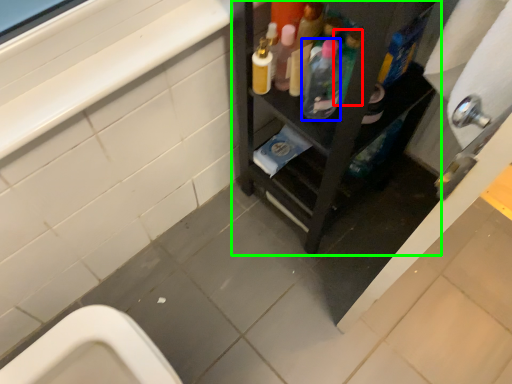
Question: Considering the real-world distances, which object is farthest from bottle (highlighted by a red box)? bottle (highlighted by a blue box) or furniture (highlighted by a green box)?

Choices:
 (A) bottle
 (B) furniture

Answer: (B)